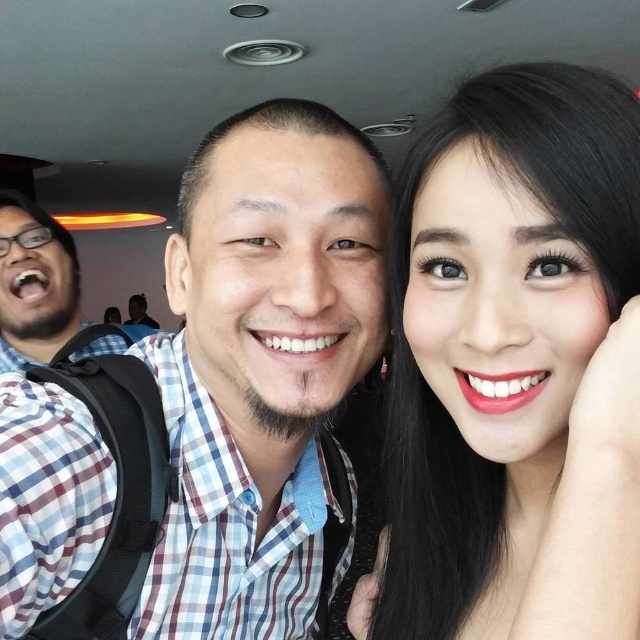
Question: Is smooth skin at upper right positioned behind matte plaid shirt at left?

Choices:
 (A) yes
 (B) no

Answer: (B)

Question: Which of the following is the farthest from the observer?

Choices:
 (A) (362, 588)
 (B) (228, 509)

Answer: (A)

Question: Which of the following is the farthest from the observer?

Choices:
 (A) matte plaid shirt at left
 (B) blue plaid shirt at center

Answer: (A)

Question: From the image, what is the correct spatial relationship of smooth skin at upper right in relation to matte plaid shirt at left?

Choices:
 (A) right
 (B) left

Answer: (A)

Question: Is blue plaid shirt at center to the right of matte plaid shirt at left from the viewer's perspective?

Choices:
 (A) no
 (B) yes

Answer: (B)

Question: Which point is farther to the camera?

Choices:
 (A) (358, 209)
 (B) (28, 266)
 (C) (513, 100)

Answer: (B)